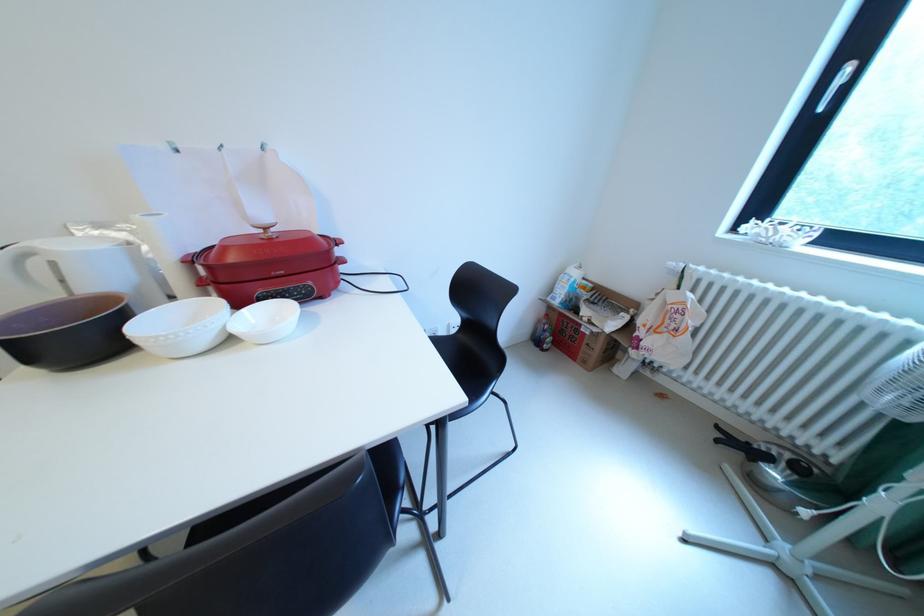
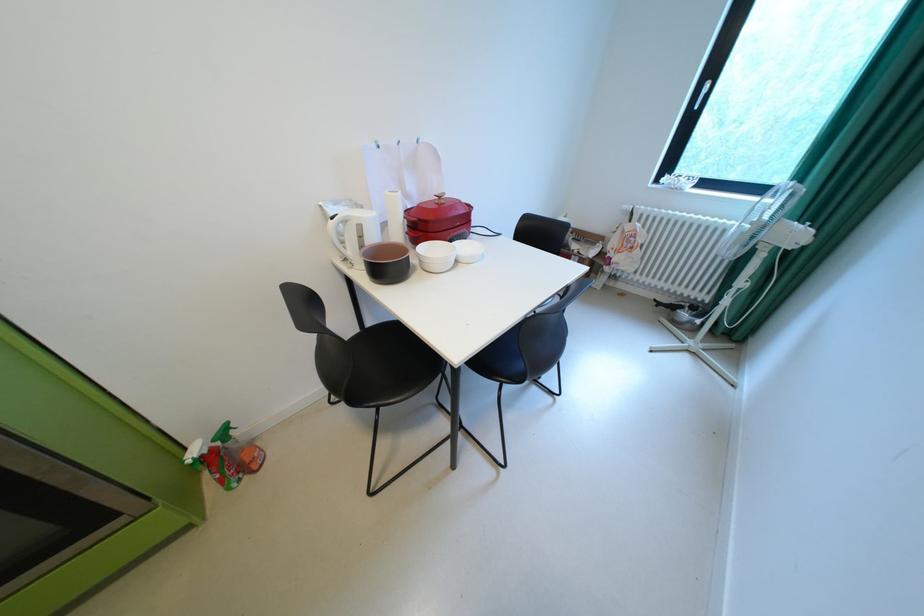
Where in the second image is the point corresponding to (x=275, y=229) from the first image?

(450, 198)